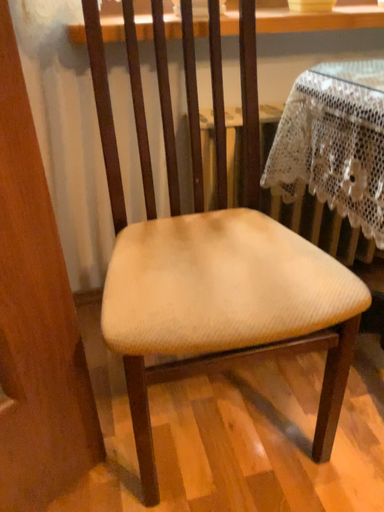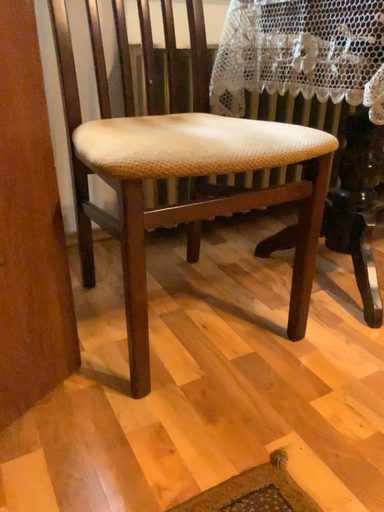
Question: How did the camera likely rotate when shooting the video?

Choices:
 (A) rotated right
 (B) rotated left

Answer: (A)